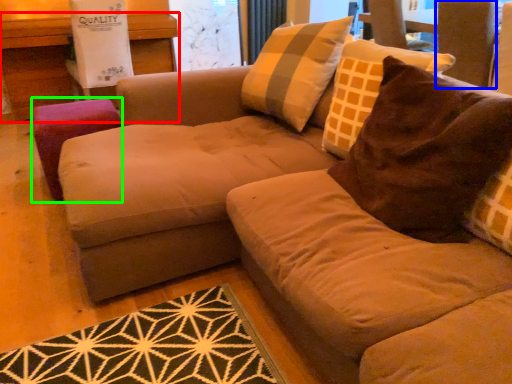
Question: Which is farther away from table (highlighted by a red box)? swivel chair (highlighted by a blue box) or stool (highlighted by a green box)?

Choices:
 (A) swivel chair
 (B) stool

Answer: (A)